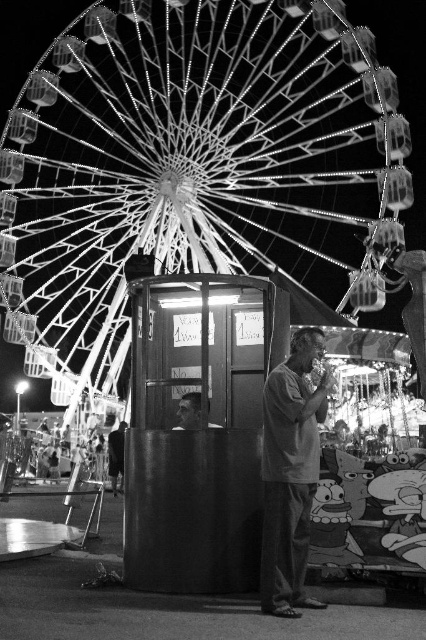
Does smooth black shirt at center have a smaller size compared to smooth skin face at center?

No.

Is smooth black shirt at center positioned in front of smooth skin face at center?

No.

Is point (114, 436) more distant than point (195, 396)?

That is True.

The height and width of the screenshot is (640, 426). I want to click on smooth black shirt at center, so click(x=115, y=456).

Measure the distance between metallic ferris wheel at upper center and smooth black shirt at center.

metallic ferris wheel at upper center is 53.68 meters from smooth black shirt at center.

Is metallic ferris wheel at upper center in front of smooth black shirt at center?

Yes, metallic ferris wheel at upper center is in front of smooth black shirt at center.

You are a GUI agent. You are given a task and a screenshot of the screen. Output one action in this format:
    pyautogui.click(x=<x>, y=<y>)
    Task: Click on the metallic ferris wheel at upper center
    The height and width of the screenshot is (640, 426).
    Given the screenshot: What is the action you would take?
    pyautogui.click(x=193, y=163)

Who is more forward, (325, 369) or (109, 472)?

Point (325, 369) is in front.

Is the position of matte gray shirt at center less distant than that of smooth black shirt at center?

That is True.

At what (x,y) coordinates should I click in order to perform the action: click on matte gray shirt at center. Please return your answer as a coordinate pair (x, y). This screenshot has width=426, height=640. Looking at the image, I should click on (290, 474).